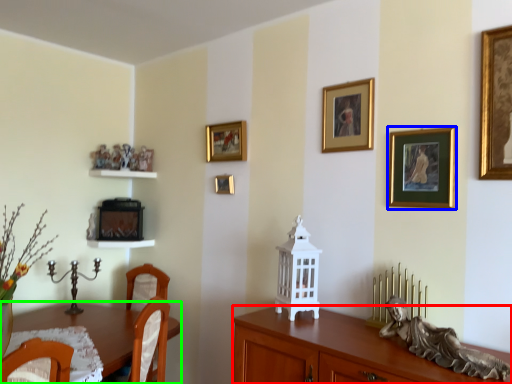
Question: Which object is positioned closest to cabinetry (highlighted by a red box)? Select from picture frame (highlighted by a blue box) and desk (highlighted by a green box).

Choices:
 (A) picture frame
 (B) desk

Answer: (A)